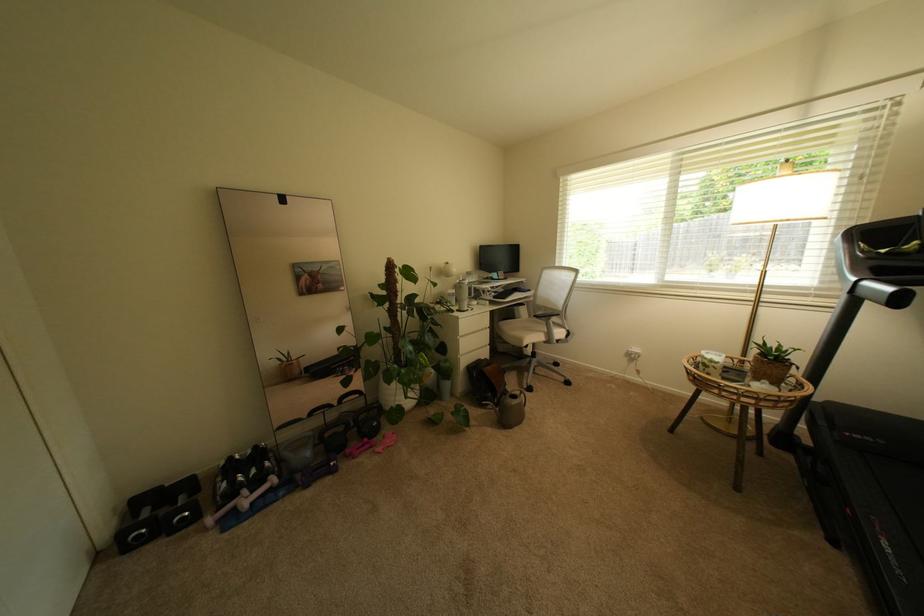
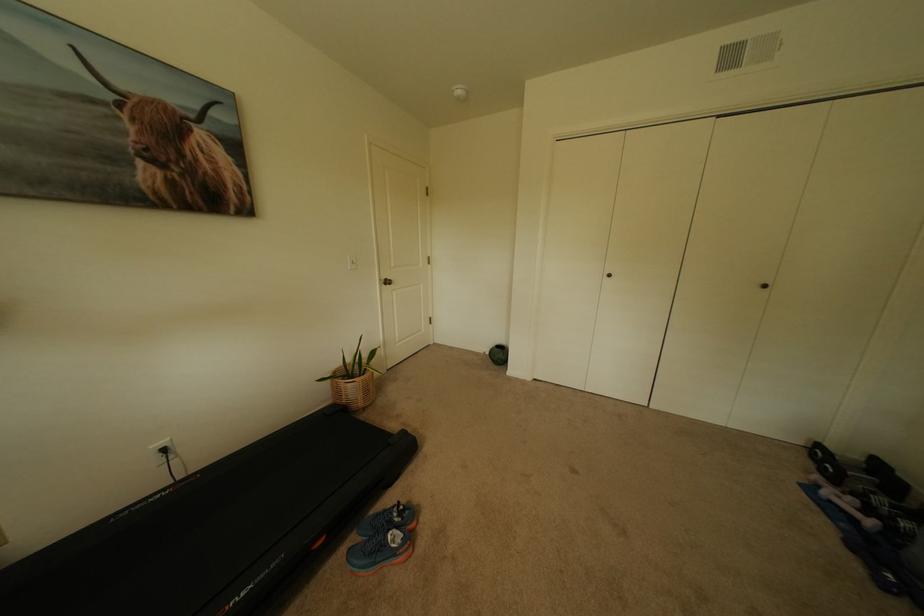
The point at (142,535) is marked in the first image. Where is the corresponding point in the second image?

(827, 452)